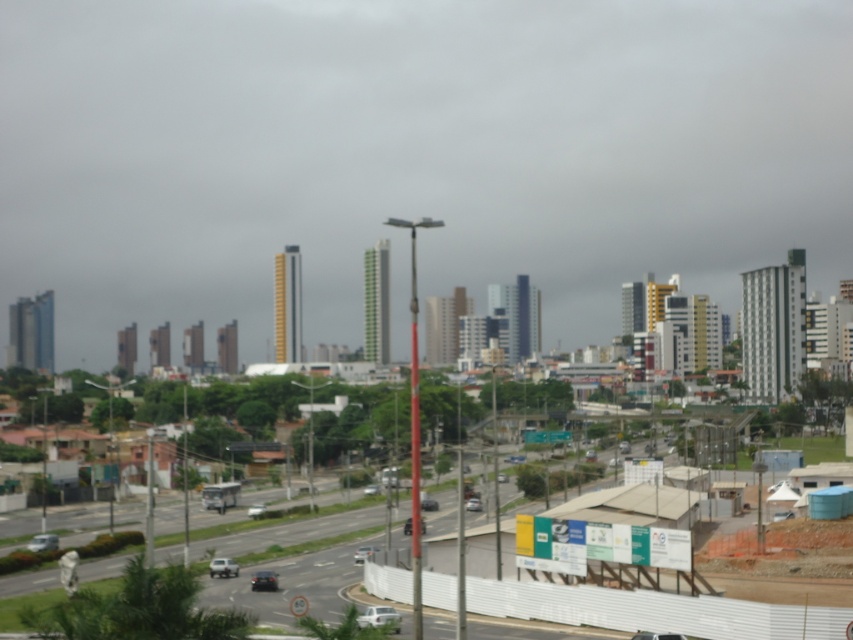
From the picture: You are a delivery driver needing to park your silver metallic sedan at center near the white plastic fence at lower center. The parking spot is exactly 50 meters away from the fence. Will your car be able to park within the designated area?

The distance between the white plastic fence at lower center and the silver metallic sedan at center is 57.44 meters. Since the parking spot requires being within 50 meters of the fence, the car would be 7.44 meters beyond the designated area and cannot park there.

You are a delivery driver approaching the white plastic fence at lower center and the silver metallic sedan at center. Your truck is 2 meters tall. Can you safely pass under both without hitting them?

The white plastic fence at lower center is much taller than the silver metallic sedan at center. Since the fence is taller, but the exact height isn not provided, it is uncertain if the truck can pass safely. However, since the sedan is shorter than the fence, if the fence is over 2 meters, the truck might hit it. Without specific measurements, it is safer to assume potential risk.

You are a pedestrian standing at the edge of the multi lane road with vehicles in both directions. You see a matte silver car at lower left and a silver metallic car at lower left. Which car is closer to you?

The matte silver car at lower left is closer to you since it is in front of the silver metallic car at lower left.